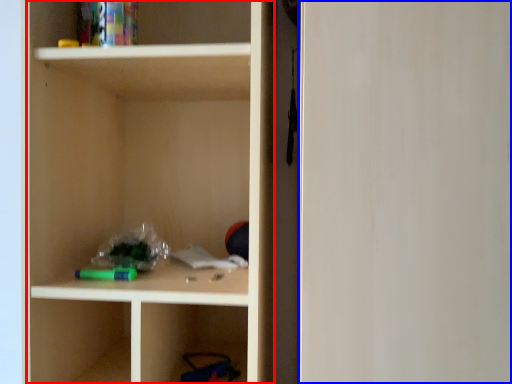
Question: Which object appears farthest to the camera in this image, cabinetry (highlighted by a red box) or glass door (highlighted by a blue box)?

Choices:
 (A) cabinetry
 (B) glass door

Answer: (A)